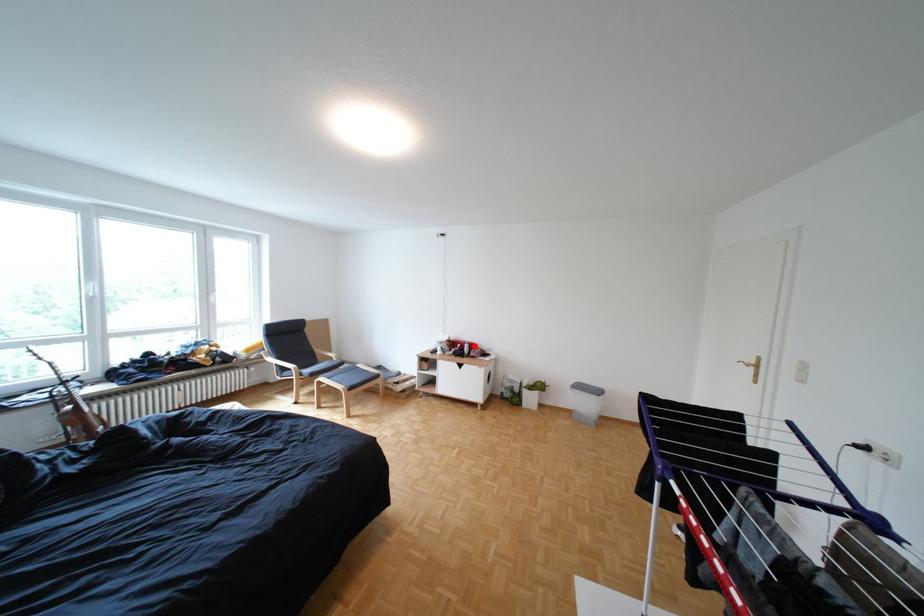
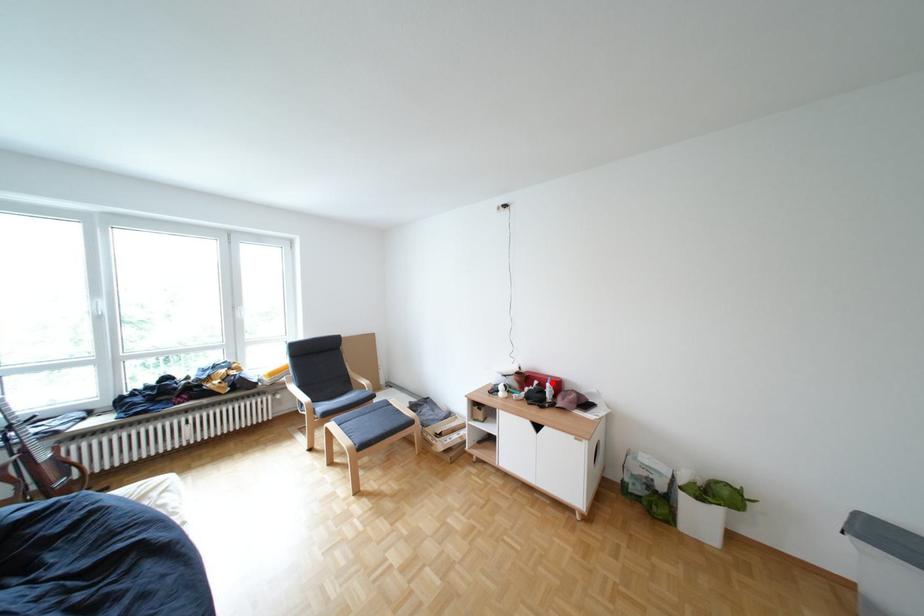
I am providing you with two images of the same scene from different viewpoints. A red point is marked on the first image and another point is marked on the second image. Do the highlighted points in image1 and image2 indicate the same real-world spot?

Yes